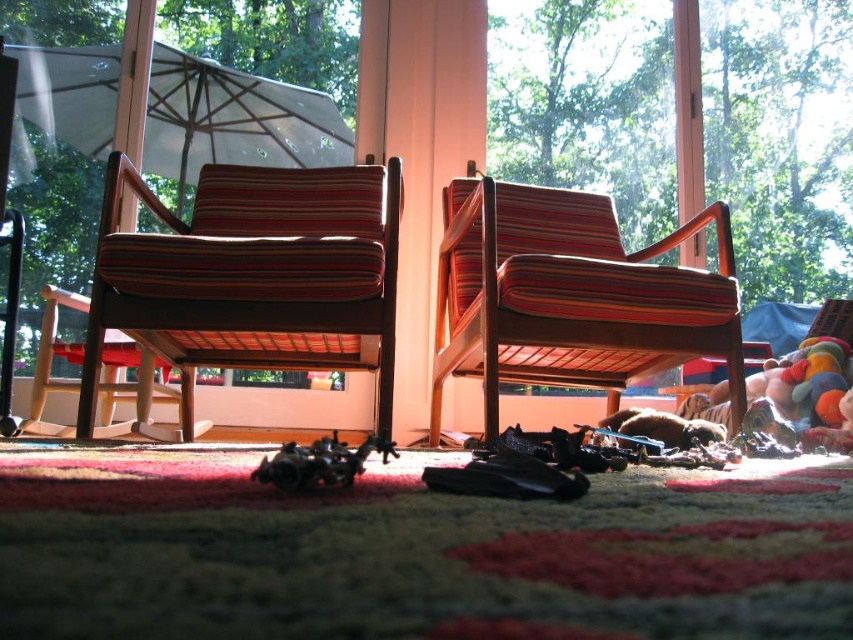
You are sitting in the striped fabric chair at center and want to grab the white fabric umbrella at upper left. Which direction should you move to reach it?

The striped fabric chair at center is in front of the white fabric umbrella at upper left, so you should move backward to reach it.

From the picture: You are standing at the camera position and want to pick up a toy that is 3 feet away from you. Is the striped fabric chair at left closer to you than the toy?

The striped fabric chair at left is 4.85 feet away from the camera, which is farther than the 3 feet distance to the toy. Therefore, the toy is closer to you than the chair.